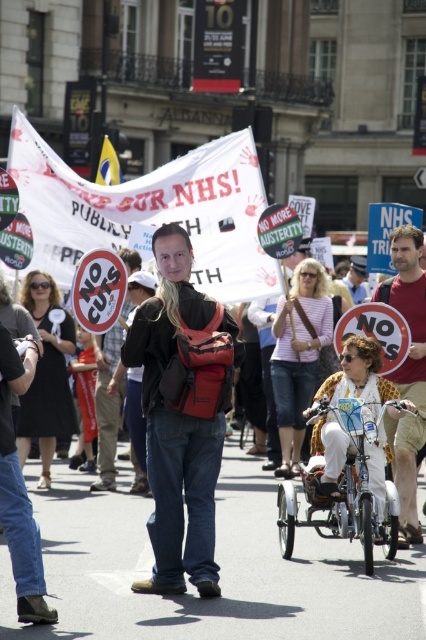
Between white plastic tricycle at center and matte black sign at center, which one is positioned higher?

matte black sign at center

Is point (362, 442) behind point (365, 275)?

No, (362, 442) is closer to viewer.

Where is `white plastic tricycle at center`? The width and height of the screenshot is (426, 640). white plastic tricycle at center is located at coordinates click(x=342, y=490).

Can you confirm if matte red sign at center is smaller than matte black sign at center?

Yes, matte red sign at center is smaller than matte black sign at center.

Image resolution: width=426 pixels, height=640 pixels. Describe the element at coordinates (408, 372) in the screenshot. I see `matte red sign at center` at that location.

Does point (425, 340) come in front of point (345, 276)?

Yes, point (425, 340) is in front of point (345, 276).

Locate an element on the screen. matte red sign at center is located at coordinates (408, 372).

Does white plastic tricycle at center have a smaller size compared to matte red sign at center?

Yes, white plastic tricycle at center is smaller than matte red sign at center.

Consider the image. Which is above, white plastic tricycle at center or matte red sign at center?

matte red sign at center

Does point (348, 486) come farther from viewer compared to point (414, 244)?

No.

Locate an element on the screen. Image resolution: width=426 pixels, height=640 pixels. white plastic tricycle at center is located at coordinates coord(342,490).